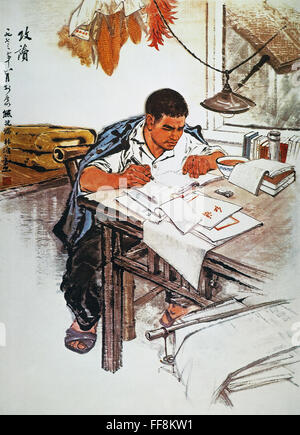
The image size is (300, 435). Find the location of `bowl`. bowl is located at coordinates (230, 159).